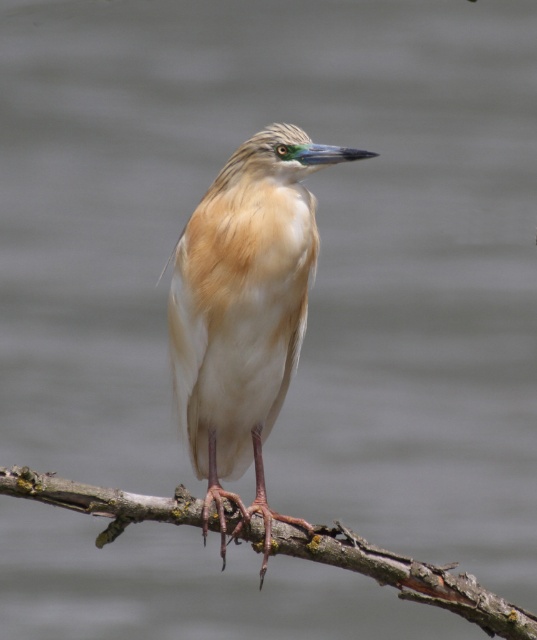
Question: Which of the following is the farthest from the observer?

Choices:
 (A) (256, 337)
 (B) (453, 592)

Answer: (B)

Question: Does light brown feathered bird at center have a greater width compared to brown rough branch at center?

Choices:
 (A) yes
 (B) no

Answer: (B)

Question: Is light brown feathered bird at center bigger than brown rough branch at center?

Choices:
 (A) no
 (B) yes

Answer: (A)

Question: Among these objects, which one is nearest to the camera?

Choices:
 (A) brown rough branch at center
 (B) light brown feathered bird at center

Answer: (A)

Question: Does light brown feathered bird at center lie behind brown rough branch at center?

Choices:
 (A) yes
 (B) no

Answer: (A)